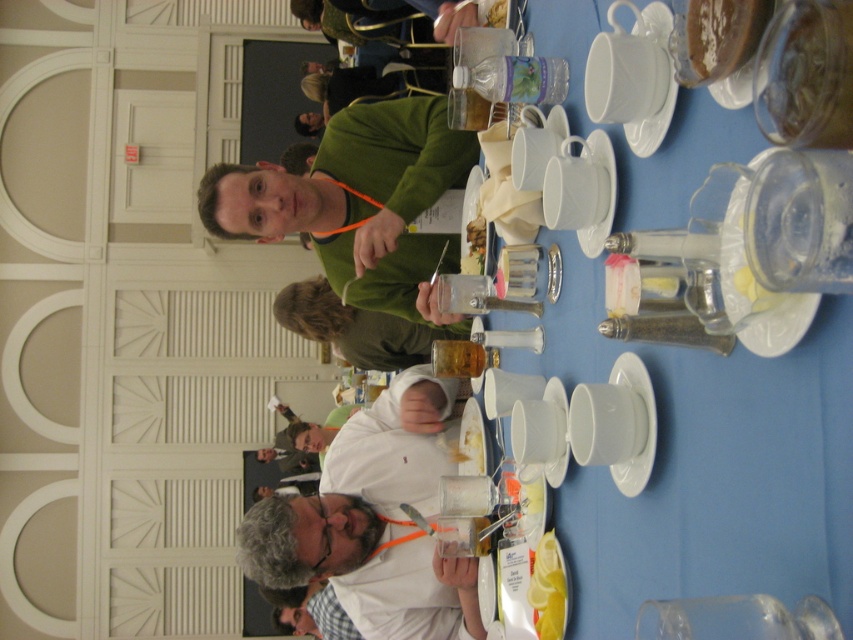
Question: Which point is farther from the camera taking this photo?

Choices:
 (A) (669, 10)
 (B) (479, 266)

Answer: (B)

Question: Is green matte sweater at upper center bigger than shiny brown sauce at upper right?

Choices:
 (A) no
 (B) yes

Answer: (B)

Question: Which point is farther to the camera?

Choices:
 (A) shiny brown sauce at upper right
 (B) yellow lemon at lower center
 (C) white porcelain plate at upper center
 (D) smooth wooden spoon at upper center

Answer: (D)

Question: Is white porcelain plate at upper right bigger than white ceramic plate at upper center?

Choices:
 (A) no
 (B) yes

Answer: (B)

Question: Considering the real-world distances, which object is closest to the green matte sweater at upper center?

Choices:
 (A) white ceramic plate at upper center
 (B) white glossy plate at lower center
 (C) shiny brown sauce at upper right

Answer: (A)

Question: Is shiny brown sauce at upper right positioned at the back of smooth wooden spoon at upper center?

Choices:
 (A) yes
 (B) no

Answer: (B)